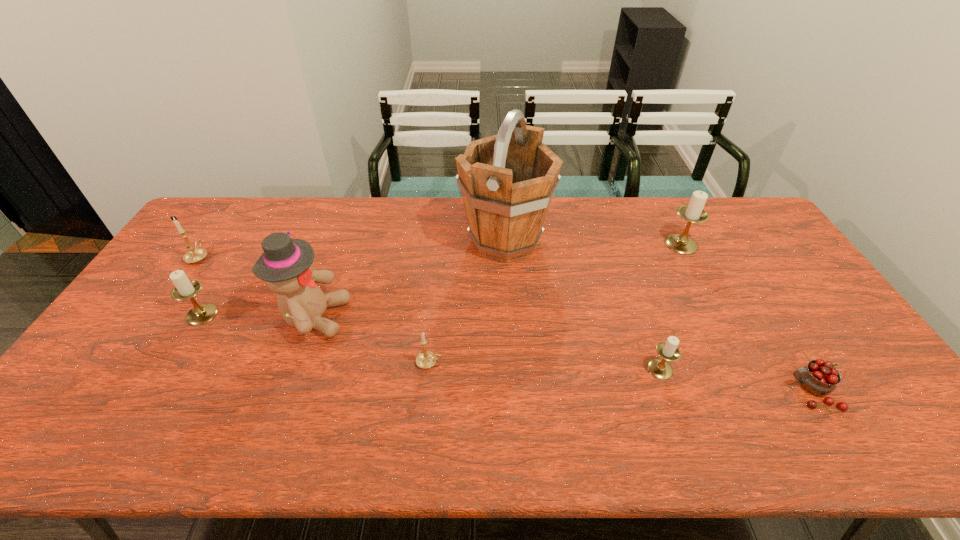
At what (x,y) coordinates should I click in order to perform the action: click on free space that satisfies the following two spatial constraints: 1. on the front-facing side of the seventh shortest object; 2. on the back side of the second white candle holder from right to left. Please return your answer as a coordinate pair (x, y). Looking at the image, I should click on (296, 369).

Identify the location of vacant region that satisfies the following two spatial constraints: 1. on the front side of the smallest white candle holder; 2. on the right side of the third farthest candle holder. The image size is (960, 540). (169, 369).

Identify the location of free space that satisfies the following two spatial constraints: 1. on the handle side of the second white candle holder from right to left; 2. on the left side of the smaller gold candle holder. This screenshot has height=540, width=960. (428, 369).

This screenshot has height=540, width=960. In order to click on free location that satisfies the following two spatial constraints: 1. on the front side of the rightmost candle holder; 2. on the handle side of the right gold candle holder in this screenshot , I will do `click(741, 362)`.